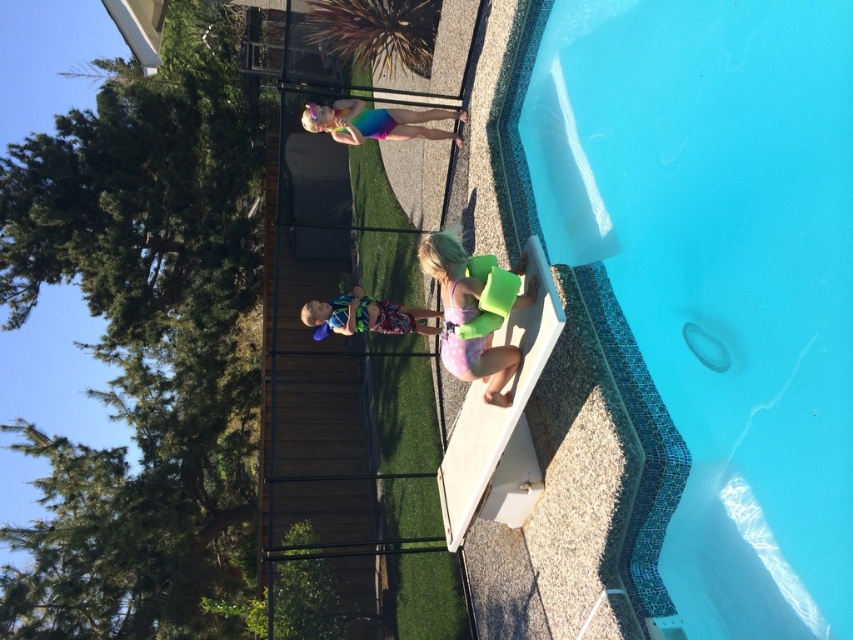
Question: Considering the real-world distances, which object is farthest from the green foam float at lower center?

Choices:
 (A) blue printed shorts at center
 (B) blue mosaic tile at upper right
 (C) rainbow swimsuit at upper center

Answer: (C)

Question: Among these points, which one is farthest from the camera?

Choices:
 (A) (503, 372)
 (B) (387, 125)

Answer: (B)

Question: Which object appears farthest from the camera in this image?

Choices:
 (A) blue mosaic tile at upper right
 (B) blue printed shorts at center
 (C) rainbow swimsuit at upper center

Answer: (C)

Question: Does blue mosaic tile at upper right lie in front of green foam float at lower center?

Choices:
 (A) yes
 (B) no

Answer: (A)

Question: Is rainbow swimsuit at upper center above blue printed shorts at center?

Choices:
 (A) no
 (B) yes

Answer: (B)

Question: Can you confirm if rainbow swimsuit at upper center is positioned to the left of blue printed shorts at center?

Choices:
 (A) yes
 (B) no

Answer: (B)